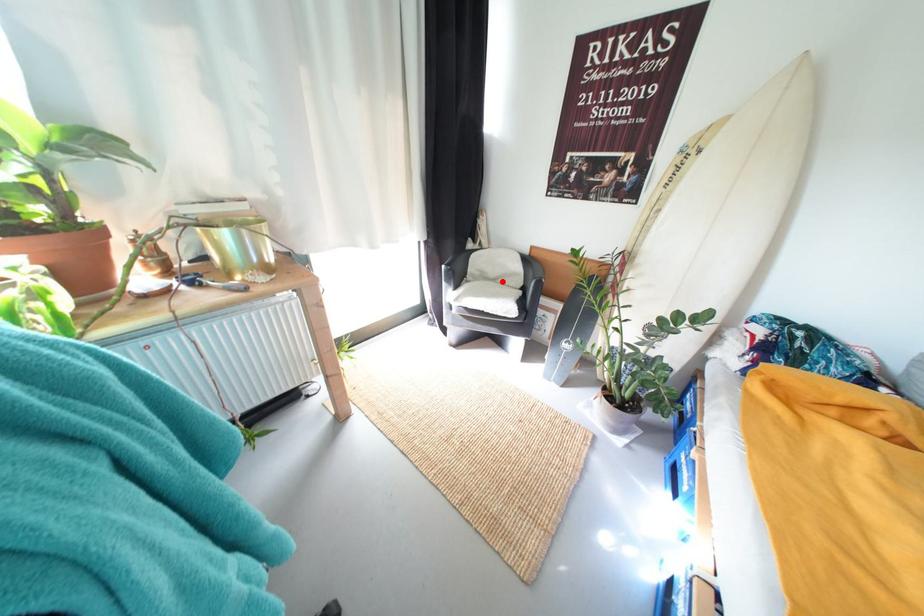
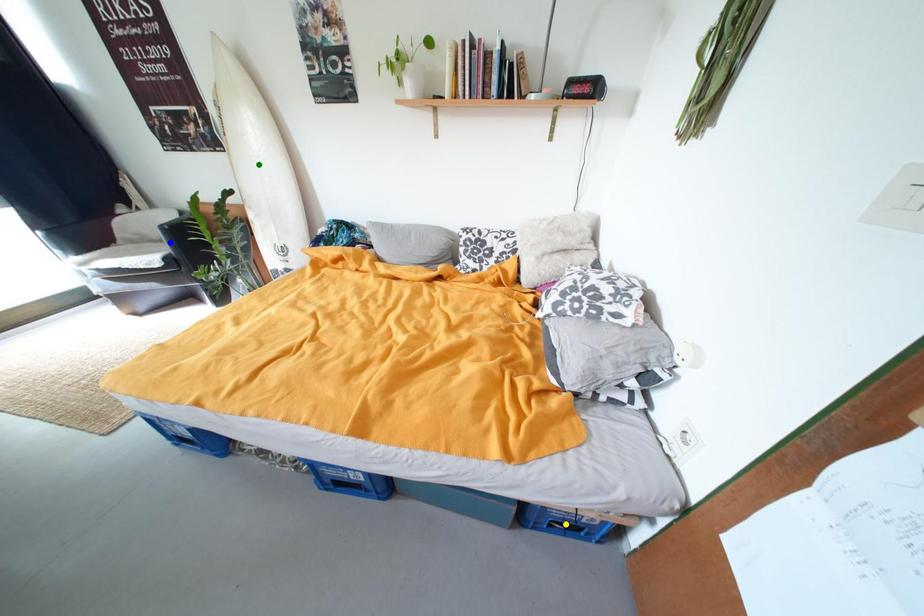
Question: I am providing you with two images of the same scene from different viewpoints. A red point is marked on the first image. You are given multiple points on the second image. In image 2, which mark is for the same physical point as the one in image 1?

Choices:
 (A) yellow point
 (B) green point
 (C) blue point

Answer: (C)